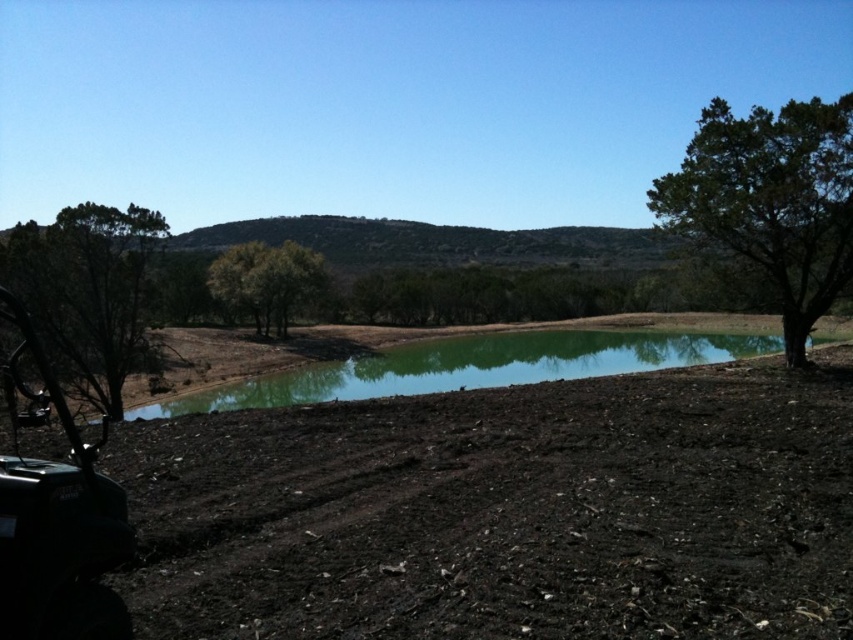
Which of these two, black matte jeep at left or green leafy tree at center, stands taller?

green leafy tree at center is taller.

Is point (53, 634) closer to viewer compared to point (244, 296)?

Yes, it is in front of point (244, 296).

At what (x,y) coordinates should I click in order to perform the action: click on black matte jeep at left. Please return your answer as a coordinate pair (x, y). Looking at the image, I should click on (56, 518).

You are a GUI agent. You are given a task and a screenshot of the screen. Output one action in this format:
    pyautogui.click(x=<x>, y=<y>)
    Task: Click on the green reflective water at center
    The image size is (853, 640).
    Given the screenshot: What is the action you would take?
    pyautogui.click(x=471, y=365)

Can you confirm if green reflective water at center is positioned to the right of green leafy tree at left?

Correct, you'll find green reflective water at center to the right of green leafy tree at left.

The width and height of the screenshot is (853, 640). I want to click on green reflective water at center, so click(471, 365).

Between point (83, 472) and point (88, 266), which one is positioned behind?

Positioned behind is point (88, 266).

Image resolution: width=853 pixels, height=640 pixels. I want to click on black matte jeep at left, so click(x=56, y=518).